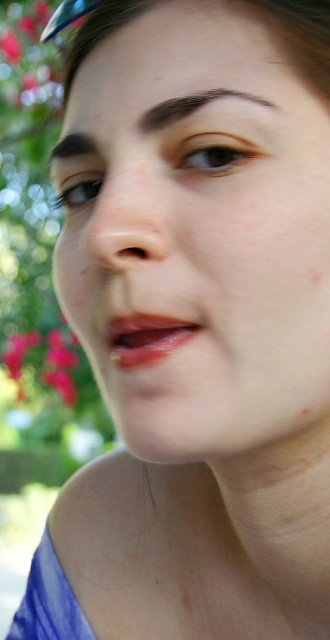
Question: Can you confirm if smooth skin face at center is positioned to the left of bright pink petals at lower left?

Choices:
 (A) no
 (B) yes

Answer: (A)

Question: Which of the following is the farthest from the observer?

Choices:
 (A) smooth skin face at center
 (B) bright pink petals at lower left

Answer: (B)

Question: Which object appears closest to the camera in this image?

Choices:
 (A) bright pink petals at lower left
 (B) smooth skin face at center

Answer: (B)

Question: In this image, where is smooth skin face at center located relative to bright pink petals at lower left?

Choices:
 (A) above
 (B) below

Answer: (A)

Question: Observing the image, what is the correct spatial positioning of smooth skin face at center in reference to bright pink petals at lower left?

Choices:
 (A) right
 (B) left

Answer: (A)